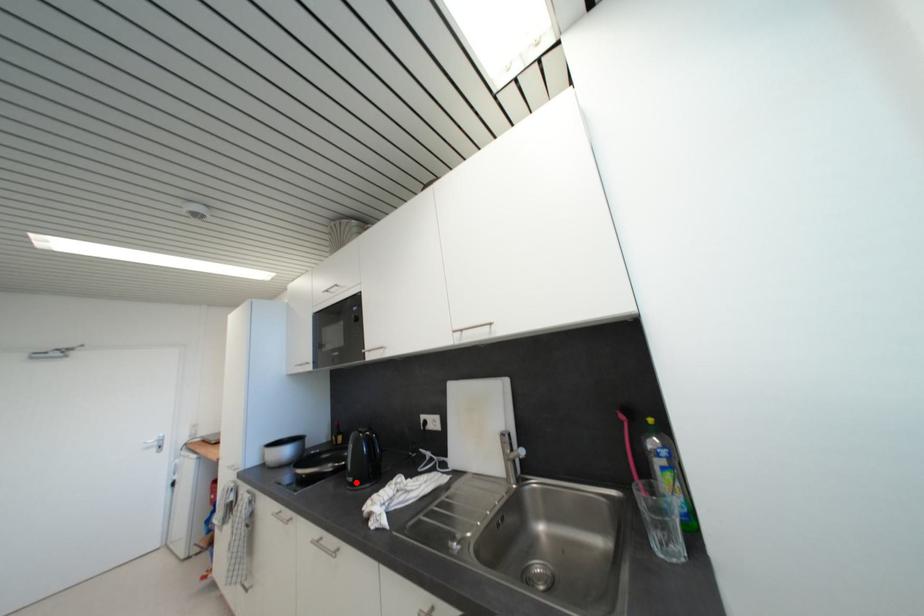
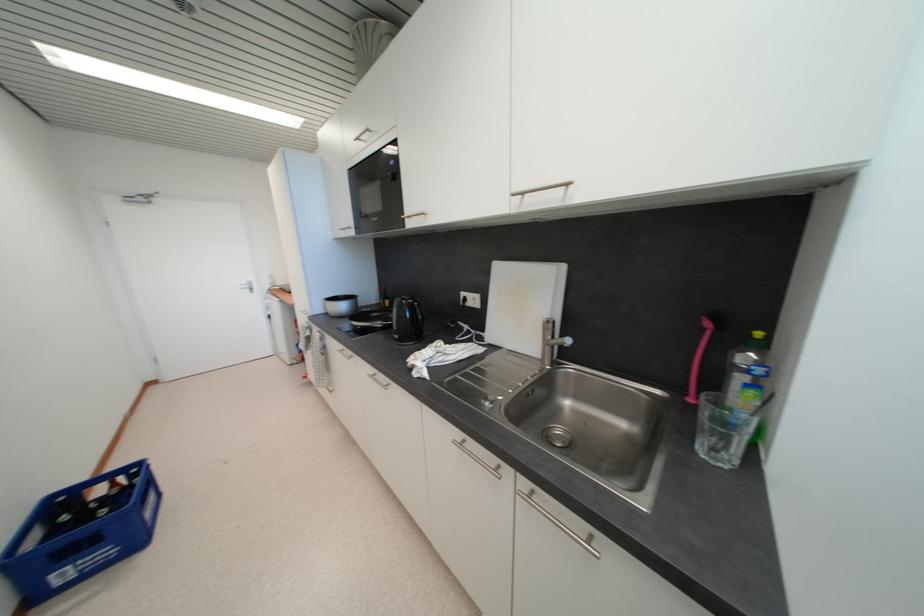
Locate, in the second image, the point that corresponds to the highlighted location in the first image.

(402, 339)